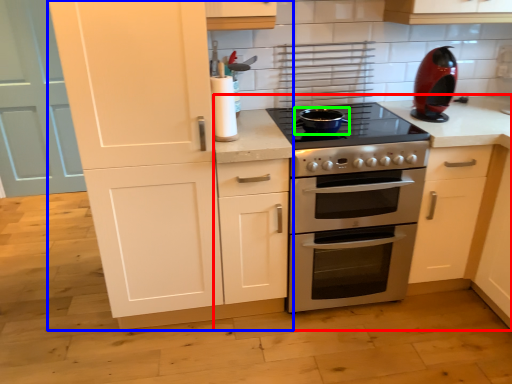
Question: Considering the real-world distances, which object is farthest from countertop (highlighted by a red box)? cabinetry (highlighted by a blue box) or appliance (highlighted by a green box)?

Choices:
 (A) cabinetry
 (B) appliance

Answer: (A)